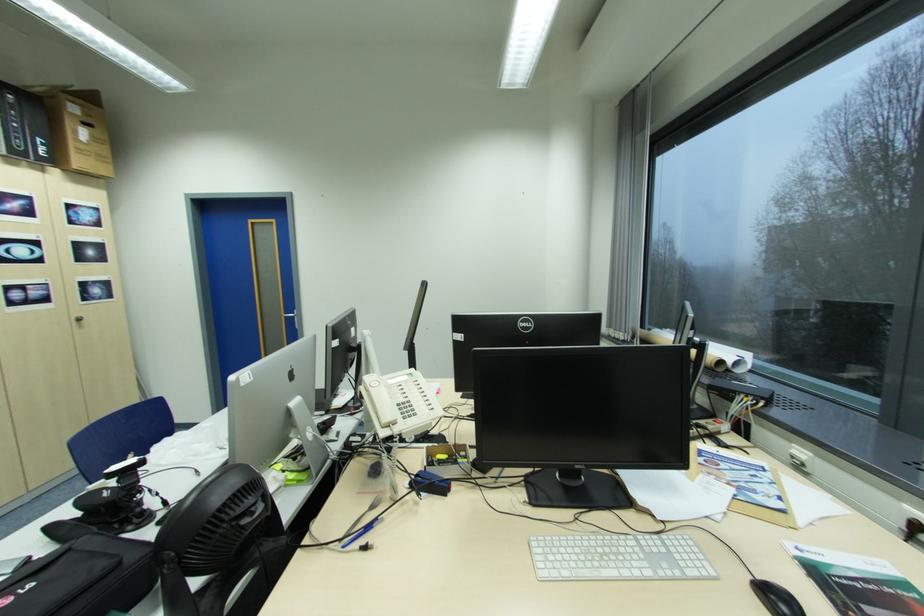
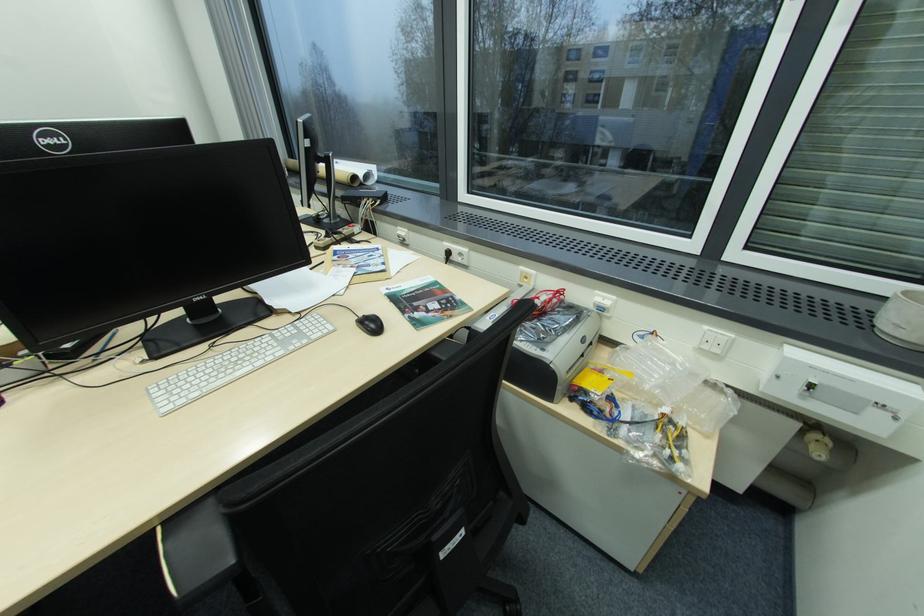
First-person continuous shooting, in which direction is the camera rotating?

The camera's rotation is toward right-down.